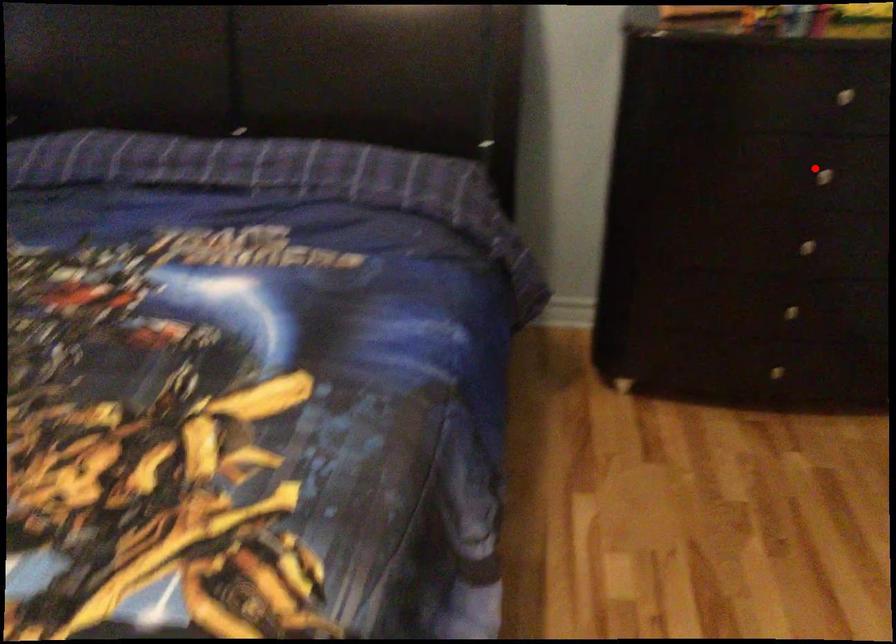
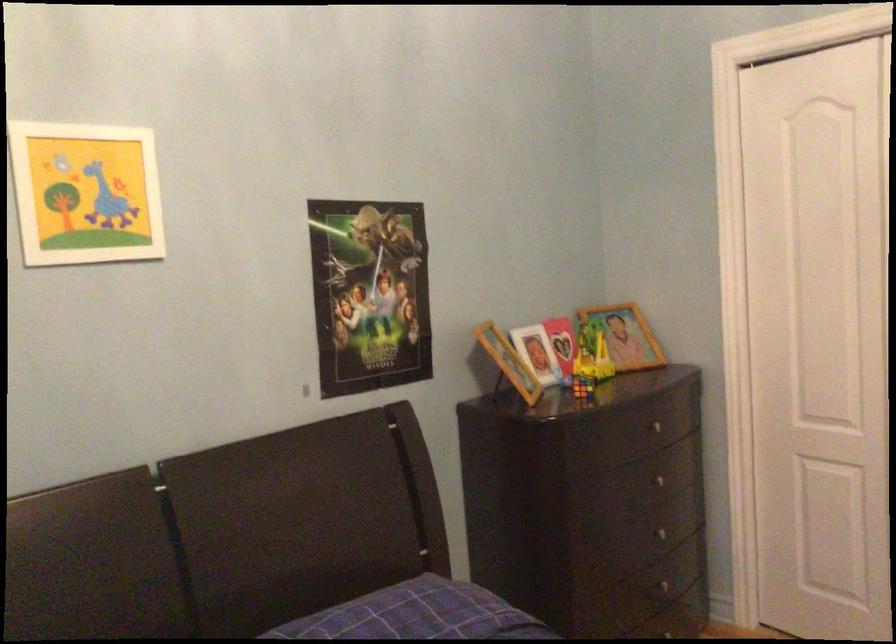
Question: I am providing you with two images of the same scene from different viewpoints. A red point is marked on the first image. At the location where the point appears in image 1, is it still visible in image 2?

Choices:
 (A) Yes
 (B) No

Answer: (A)